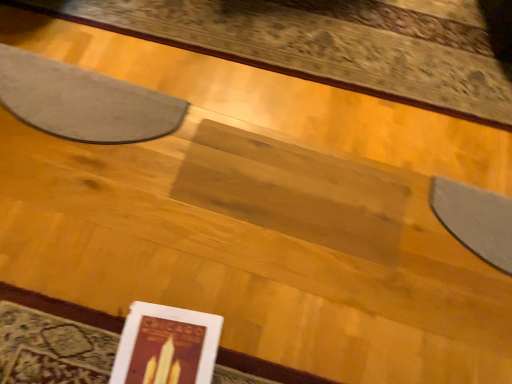
Identify the location of free point behind matte paper book at lower left. The height and width of the screenshot is (384, 512). (187, 268).